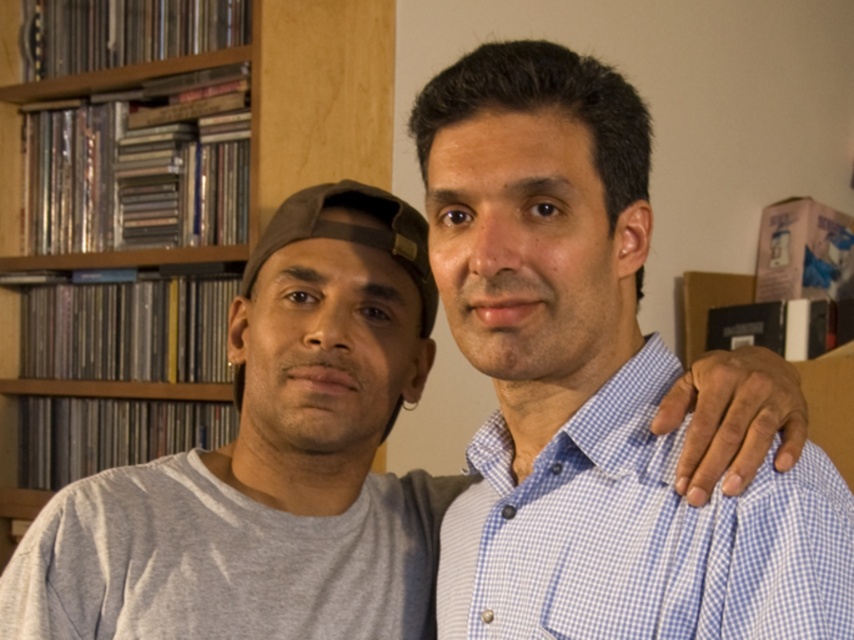
Who is more forward, (455, 156) or (600, 540)?

Point (455, 156) is more forward.

This screenshot has height=640, width=854. Describe the element at coordinates (595, 380) in the screenshot. I see `blue checkered shirt at center` at that location.

Who is more distant from viewer, (472, 602) or (724, 628)?

The point (472, 602) is behind.

Image resolution: width=854 pixels, height=640 pixels. I want to click on blue checkered shirt at center, so click(595, 380).

Does gray cotton t-shirt at center have a greater height compared to blue checkered shirt at right?

Correct, gray cotton t-shirt at center is much taller as blue checkered shirt at right.

Between gray cotton t-shirt at center and blue checkered shirt at right, which one has less height?

Standing shorter between the two is blue checkered shirt at right.

Describe the element at coordinates (268, 461) in the screenshot. I see `gray cotton t-shirt at center` at that location.

Find the location of `gray cotton t-shirt at center`. gray cotton t-shirt at center is located at coordinates (268, 461).

Between blue checkered shirt at center and wooden bookshelf at upper left, which one appears on the right side from the viewer's perspective?

Positioned to the right is blue checkered shirt at center.

Does blue checkered shirt at center have a greater height compared to wooden bookshelf at upper left?

No, blue checkered shirt at center is not taller than wooden bookshelf at upper left.

Locate an element on the screen. This screenshot has width=854, height=640. blue checkered shirt at center is located at coordinates (595, 380).

Find the location of a particular element. The width and height of the screenshot is (854, 640). blue checkered shirt at center is located at coordinates (595, 380).